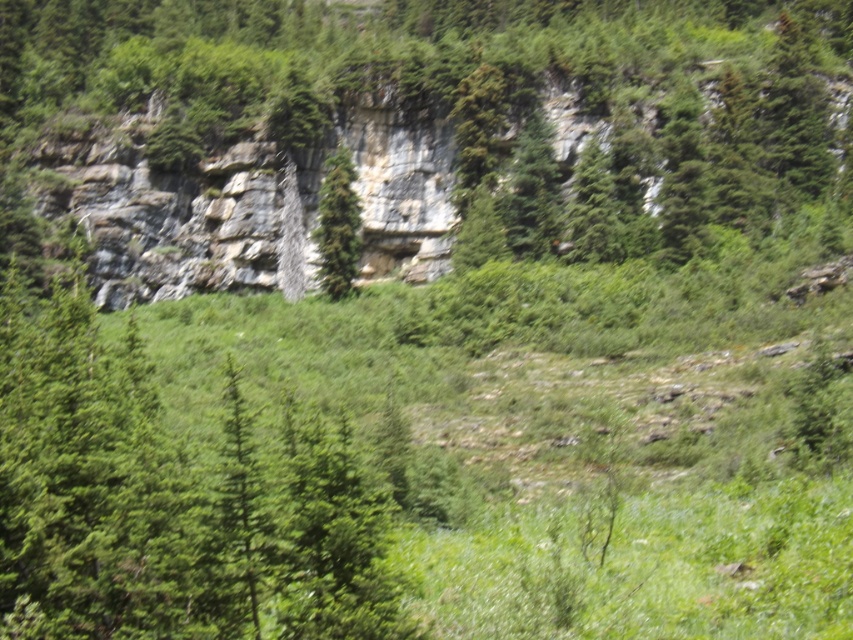
Question: Which of the following is the farthest from the observer?

Choices:
 (A) green leafy tree at upper center
 (B) green matte tree at center
 (C) green textured tree at center
 (D) green leafy tree at center

Answer: (C)

Question: From the image, what is the correct spatial relationship of green leafy tree at upper center in relation to green textured tree at center?

Choices:
 (A) right
 (B) left

Answer: (B)

Question: Which object is farther from the camera taking this photo?

Choices:
 (A) green textured tree at center
 (B) green leafy tree at upper center
 (C) green matte tree at center

Answer: (A)

Question: Is green matte tree at center wider than green leafy tree at center?

Choices:
 (A) yes
 (B) no

Answer: (A)

Question: Which of the following is the farthest from the observer?

Choices:
 (A) green leafy tree at upper center
 (B) green textured tree at center
 (C) green matte tree at center
 (D) green leafy tree at center

Answer: (B)

Question: Can you confirm if green leafy tree at upper center is positioned above green leafy tree at center?

Choices:
 (A) no
 (B) yes

Answer: (A)